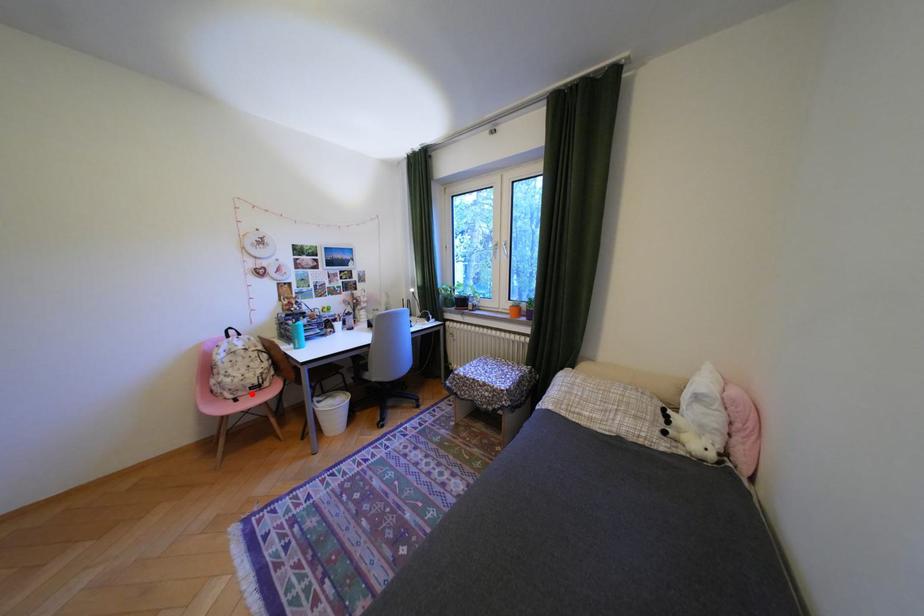
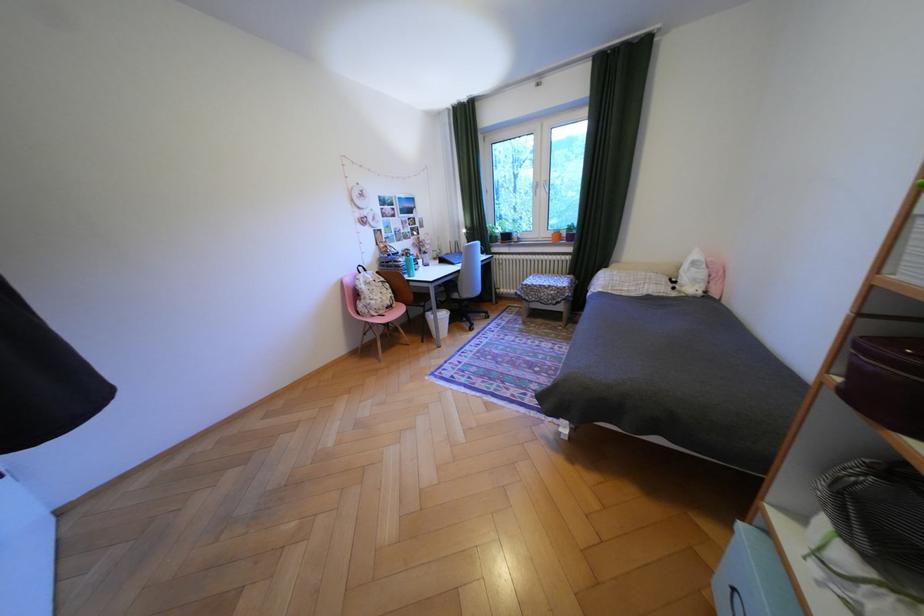
In the second image, find the point that corresponds to the highlighted location in the first image.

(393, 312)